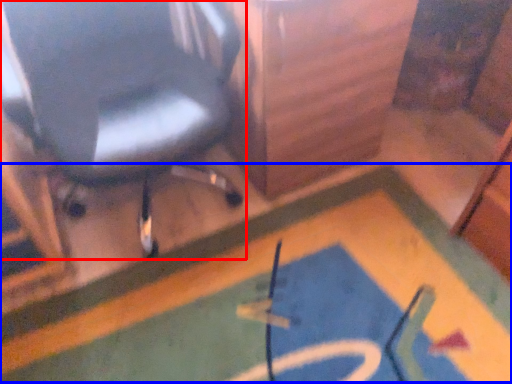
Question: Among these objects, which one is nearest to the camera, chair (highlighted by a red box) or bath mat (highlighted by a blue box)?

Choices:
 (A) chair
 (B) bath mat

Answer: (A)